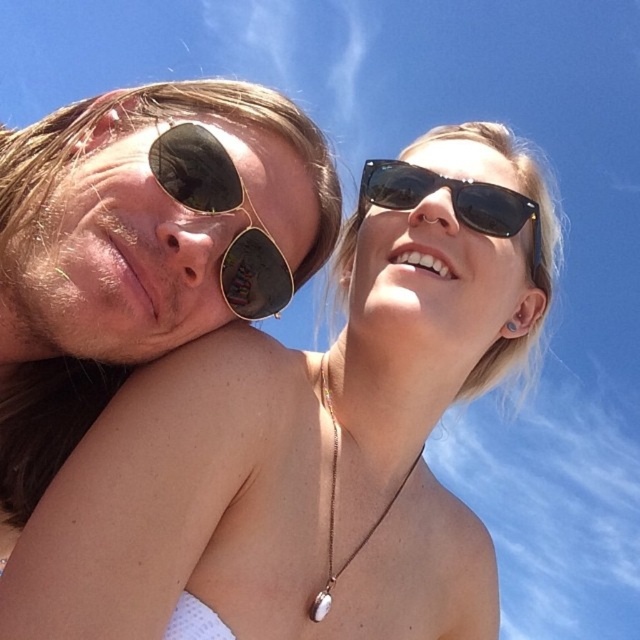
Question: Considering the real-world distances, which object is farthest from the matte gold necklace at center?

Choices:
 (A) gold mirrored sunglasses at upper left
 (B) black reflective sunglasses at upper right
 (C) silver metallic necklace at center

Answer: (B)

Question: From the image, what is the correct spatial relationship of matte gold necklace at center in relation to silver metallic necklace at center?

Choices:
 (A) below
 (B) above

Answer: (B)

Question: Based on their relative distances, which object is nearer to the gold mirrored sunglasses at upper left?

Choices:
 (A) matte gold necklace at center
 (B) black reflective sunglasses at upper right
 (C) silver metallic necklace at center

Answer: (A)

Question: Where is gold mirrored sunglasses at upper left located in relation to silver metallic necklace at center in the image?

Choices:
 (A) right
 (B) left

Answer: (B)

Question: Which point is closer to the camera taking this photo?

Choices:
 (A) (330, 545)
 (B) (186, 428)
 (C) (168, 161)

Answer: (B)

Question: Does gold mirrored sunglasses at upper left appear under silver metallic necklace at center?

Choices:
 (A) no
 (B) yes

Answer: (A)